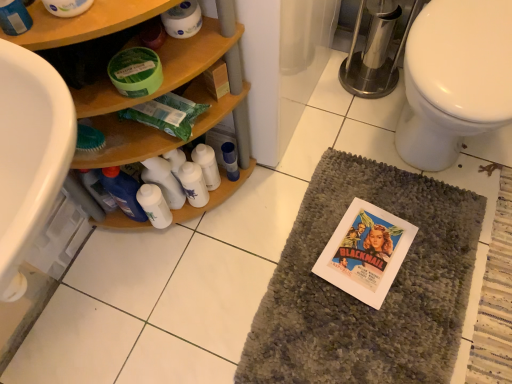
This screenshot has width=512, height=384. What are the coordinates of `free space that is in between white glossy toilet at right and white plastic bottles at center, positioned as the 1th bottle in left-to-right order` in the screenshot? It's located at (334, 166).